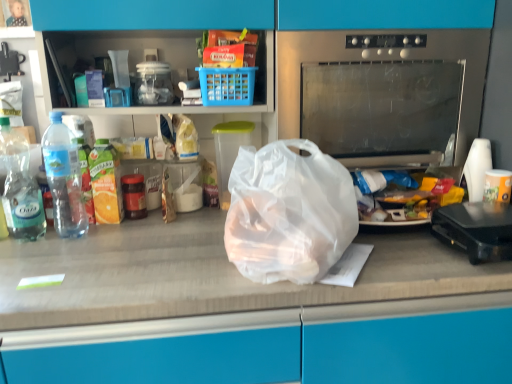
Describe the element at coordinates (227, 86) in the screenshot. The image size is (512, 384). I see `blue plastic basket at upper center` at that location.

What do you see at coordinates (476, 229) in the screenshot? I see `black plastic toaster at right` at bounding box center [476, 229].

At what (x,y) coordinates should I click in order to perform the action: click on stainless steel oven at center. Please return your answer as a coordinate pair (x, y). This screenshot has width=512, height=384. Looking at the image, I should click on pyautogui.click(x=383, y=93).

There is a transparent plastic bag at center. Where is `appliance above it (from a real-world perspective)`? appliance above it (from a real-world perspective) is located at coordinates (229, 152).

Which is closer to the camera, [226,141] or [334,169]?

Point [226,141] appears to be farther away from the viewer than point [334,169].

Could you tell me if transparent plastic container at center is turned towards transparent plastic bag at center?

Yes.

Looking at their sizes, would you say transparent plastic bag at center is wider or thinner than black plastic toaster at right?

Clearly, transparent plastic bag at center has more width compared to black plastic toaster at right.

From a real-world perspective, does transparent plastic bag at center sit lower than black plastic toaster at right?

No, from a real-world perspective, transparent plastic bag at center is not beneath black plastic toaster at right.

Looking at the image, does transparent plastic bag at center seem bigger or smaller compared to black plastic toaster at right?

transparent plastic bag at center is bigger than black plastic toaster at right.

From the image's perspective, would you say transparent plastic container at center is shown under clear plastic bottle at left, the 2th bottle when ordered from right to left?

No, from the image's perspective, transparent plastic container at center is not below clear plastic bottle at left, the 2th bottle when ordered from right to left.

Is transparent plastic container at center taller than clear plastic bottle at left, the 2th bottle when ordered from right to left?

No, transparent plastic container at center is not taller than clear plastic bottle at left, the 2th bottle when ordered from right to left.

Considering the sizes of objects transparent plastic container at center and clear plastic bottle at left, the 2th bottle when ordered from right to left, in the image provided, who is bigger, transparent plastic container at center or clear plastic bottle at left, the 2th bottle when ordered from right to left,?

transparent plastic container at center.

Is transparent plastic container at center beside clear plastic bottle at left, the 2th bottle when ordered from right to left?

No, transparent plastic container at center is not beside clear plastic bottle at left, the 2th bottle when ordered from right to left.

From the image's perspective, does blue plastic basket at upper center appear lower than clear plastic bottle at left, which is the first bottle from left to right?

No, from the image's perspective, blue plastic basket at upper center is not below clear plastic bottle at left, which is the first bottle from left to right.

Considering the positions of points (223, 98) and (14, 193), is point (223, 98) farther from camera compared to point (14, 193)?

Yes, point (223, 98) is behind point (14, 193).

Is blue plastic basket at upper center in front of clear plastic bottle at left, which is the first bottle from left to right?

No, blue plastic basket at upper center is behind clear plastic bottle at left, which is the first bottle from left to right.

From a real-world perspective, is blue plastic basket at upper center beneath clear plastic bottle at left, which is the first bottle from left to right?

No, from a real-world perspective, blue plastic basket at upper center is not under clear plastic bottle at left, which is the first bottle from left to right.

In terms of size, does blue plastic basket at upper center appear bigger or smaller than translucent plastic bag at center?

blue plastic basket at upper center is smaller than translucent plastic bag at center.

Would you say blue plastic basket at upper center is outside translucent plastic bag at center?

Yes, blue plastic basket at upper center is outside of translucent plastic bag at center.

Between blue plastic basket at upper center and translucent plastic bag at center, which one has less height?

blue plastic basket at upper center.

Based on the photo, which object is further away from the camera taking this photo, blue plastic basket at upper center or translucent plastic bag at center?

blue plastic basket at upper center.

From a real-world perspective, which is physically above, stainless steel oven at center or clear plastic bottle at left, which is the first bottle from left to right?

stainless steel oven at center.

Is stainless steel oven at center next to clear plastic bottle at left, which is the first bottle from left to right?

No, stainless steel oven at center is not next to clear plastic bottle at left, which is the first bottle from left to right.

Looking at their sizes, would you say stainless steel oven at center is wider or thinner than clear plastic bottle at left, the 2th bottle when ordered from right to left?

Clearly, stainless steel oven at center has more width compared to clear plastic bottle at left, the 2th bottle when ordered from right to left.

From the image's perspective, which is below, stainless steel oven at center or blue plastic basket at upper center?

stainless steel oven at center appears lower in the image.

Between point (321, 57) and point (239, 85), which one is positioned behind?

The point (321, 57) is farther from the camera.

Which object is wider, stainless steel oven at center or blue plastic basket at upper center?

stainless steel oven at center is wider.

How many degrees apart are the facing directions of stainless steel oven at center and blue plastic basket at upper center?

The angular difference between stainless steel oven at center and blue plastic basket at upper center is 3.1 degrees.

In order to click on plastic bag on the right of transparent plastic container at center in this screenshot , I will do `click(288, 213)`.

This screenshot has height=384, width=512. I want to click on kitchen appliance located behind the transparent plastic bag at center, so click(x=476, y=229).

Considering their positions, is clear plastic bottle at left, positioned as the first bottle in right-to-left order, positioned closer to blue plastic basket at upper center than black plastic toaster at right?

clear plastic bottle at left, positioned as the first bottle in right-to-left order, is positioned closer to the anchor blue plastic basket at upper center.

Based on their spatial positions, is black plastic toaster at right or transparent plastic container at center further from blue plastic basket at upper center?

black plastic toaster at right is positioned further to the anchor blue plastic basket at upper center.

When comparing their distances from transparent plastic bag at center, does blue plastic basket at upper center or clear plastic bottle at left, the 2th bottle when ordered from right to left, seem further?

clear plastic bottle at left, the 2th bottle when ordered from right to left, lies further to transparent plastic bag at center than the other object.

Looking at the image, which one is located further to transparent plastic bag at center, stainless steel oven at center or clear plastic bottle at left, which is the first bottle from left to right?

clear plastic bottle at left, which is the first bottle from left to right, lies further to transparent plastic bag at center than the other object.

Based on their spatial positions, is blue plastic basket at upper center or black plastic toaster at right further from transparent plastic container at center?

The object further to transparent plastic container at center is black plastic toaster at right.

Based on their spatial positions, is transparent plastic bag at center or stainless steel oven at center further from translucent plastic bag at center?

stainless steel oven at center is further to translucent plastic bag at center.

Consider the image. Which object lies further to the anchor point black plastic toaster at right, blue plastic basket at upper center or transparent plastic bag at center?

blue plastic basket at upper center.

Which object lies further to the anchor point transparent plastic bag at center, stainless steel oven at center or black plastic toaster at right?

The object further to transparent plastic bag at center is black plastic toaster at right.

Where is `plastic bag located between blue plastic basket at upper center and stainless steel oven at center in the left-right direction`? plastic bag located between blue plastic basket at upper center and stainless steel oven at center in the left-right direction is located at coordinates (288, 213).

You are a GUI agent. You are given a task and a screenshot of the screen. Output one action in this format:
    pyautogui.click(x=<x>, y=<y>)
    Task: Click on the home appliance between clear plastic bottle at left, which is the first bottle from left to right, and black plastic toaster at right
    The width and height of the screenshot is (512, 384).
    Given the screenshot: What is the action you would take?
    pyautogui.click(x=383, y=93)

In order to click on basket located between clear plastic bottle at left, positioned as the first bottle in right-to-left order, and black plastic toaster at right in the left-right direction in this screenshot , I will do `click(227, 86)`.

This screenshot has height=384, width=512. I want to click on bottle located between clear plastic bottle at left, which is the first bottle from left to right, and transparent plastic container at center in the left-right direction, so click(x=64, y=178).